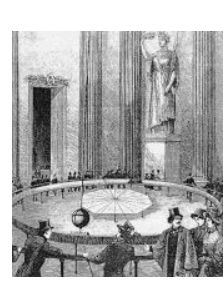
This screenshot has width=223, height=303. What are the coordinates of `archway` in the screenshot? It's located at (44, 114), (46, 169), (36, 137).